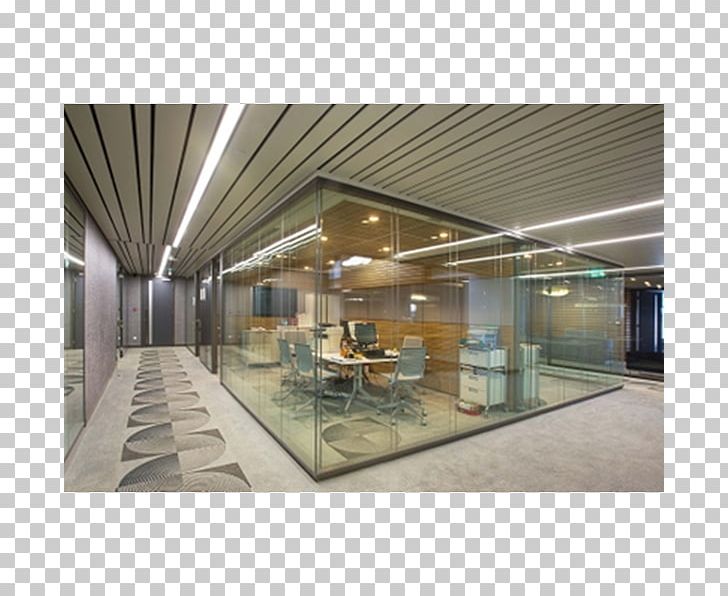
At what (x,y) coordinates should I click in order to perform the action: click on ceiling. Please return your answer as a coordinate pair (x, y). This screenshot has width=728, height=596. Looking at the image, I should click on (119, 157), (135, 211), (233, 200), (320, 136), (590, 167), (458, 145).